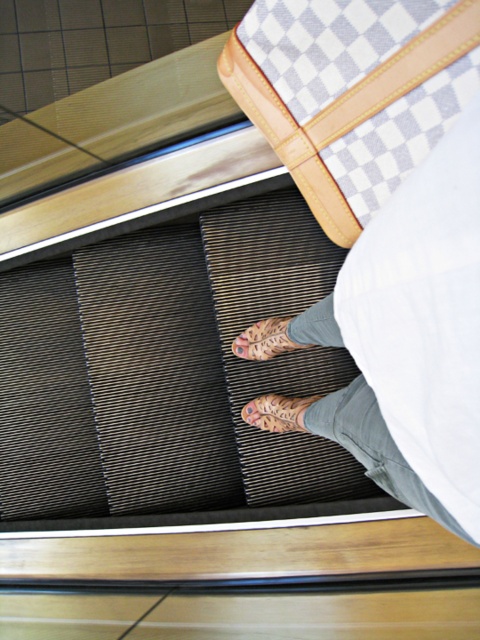
Question: Which is nearer to the leather textured shoe at center?

Choices:
 (A) white checkered fabric bag at upper center
 (B) brown textured sandals at center

Answer: (B)

Question: Which object is positioned closest to the white checkered bag at center?

Choices:
 (A) leather textured shoe at center
 (B) white checkered fabric bag at upper center
 (C) brown textured sandals at center

Answer: (B)

Question: Is white checkered fabric bag at upper center smaller than brown textured sandals at center?

Choices:
 (A) yes
 (B) no

Answer: (B)

Question: Is white checkered bag at center to the right of leather textured shoe at center from the viewer's perspective?

Choices:
 (A) no
 (B) yes

Answer: (B)

Question: Which object is the farthest from the white checkered bag at center?

Choices:
 (A) brown textured sandals at center
 (B) white checkered fabric bag at upper center
 (C) leather textured shoe at center

Answer: (A)

Question: Where is brown textured sandals at center located in relation to leather textured shoe at center in the image?

Choices:
 (A) above
 (B) below

Answer: (B)